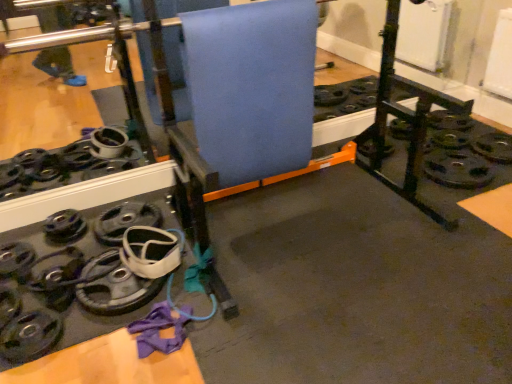
What do you see at coordinates (30, 336) in the screenshot? The image size is (512, 384). I see `black rubber weight at lower left` at bounding box center [30, 336].

I want to click on black rubber weight at lower left, so click(30, 336).

The width and height of the screenshot is (512, 384). Find the location of `blue fabric yoga mat at center`. blue fabric yoga mat at center is located at coordinates (252, 86).

What do you see at coordinates (252, 86) in the screenshot?
I see `blue fabric yoga mat at center` at bounding box center [252, 86].

What are the coordinates of `black rubber weight at lower left` in the screenshot? It's located at (30, 336).

Does blue fabric yoga mat at center appear on the right side of black rubber weight at lower left?

Indeed, blue fabric yoga mat at center is positioned on the right side of black rubber weight at lower left.

Is blue fabric yoga mat at center closer to the viewer compared to black rubber weight at lower left?

No, the depth of blue fabric yoga mat at center is greater than that of black rubber weight at lower left.

Is point (185, 63) in front of point (46, 346)?

No, it is not.

From the image's perspective, which is below, blue fabric yoga mat at center or black rubber weight at lower left?

black rubber weight at lower left.

From a real-world perspective, which is physically below, blue fabric yoga mat at center or black rubber weight at lower left?

black rubber weight at lower left.

Looking at their sizes, would you say blue fabric yoga mat at center is wider or thinner than black rubber weight at lower left?

blue fabric yoga mat at center is thinner than black rubber weight at lower left.

Between blue fabric yoga mat at center and black rubber weight at lower left, which one has more height?

blue fabric yoga mat at center is taller.

Based on their sizes in the image, would you say blue fabric yoga mat at center is bigger or smaller than black rubber weight at lower left?

blue fabric yoga mat at center is bigger than black rubber weight at lower left.

Which is correct: blue fabric yoga mat at center is inside black rubber weight at lower left, or outside of it?

blue fabric yoga mat at center is located beyond the bounds of black rubber weight at lower left.

Is blue fabric yoga mat at center far away from black rubber weight at lower left?

Yes, blue fabric yoga mat at center and black rubber weight at lower left are located far from each other.

Could you tell me if blue fabric yoga mat at center is turned towards black rubber weight at lower left?

No, blue fabric yoga mat at center is not turned towards black rubber weight at lower left.

How different are the orientations of blue fabric yoga mat at center and black rubber weight at lower left in degrees?

There is a 0.000378-degree angle between the facing directions of blue fabric yoga mat at center and black rubber weight at lower left.

You are a GUI agent. You are given a task and a screenshot of the screen. Output one action in this format:
    pyautogui.click(x=<x>, y=<y>)
    Task: Click on the yoga mat located on the right of black rubber weight at lower left
    
    Given the screenshot: What is the action you would take?
    pyautogui.click(x=252, y=86)

In the scene shown: Is black rubber weight at lower left at the left side of blue fabric yoga mat at center?

Yes.

Considering the relative positions of black rubber weight at lower left and blue fabric yoga mat at center in the image provided, is black rubber weight at lower left behind blue fabric yoga mat at center?

No, black rubber weight at lower left is closer to the viewer.

Is point (55, 317) closer to camera compared to point (301, 103)?

Yes.

From the image's perspective, who appears lower, black rubber weight at lower left or blue fabric yoga mat at center?

From the image's view, black rubber weight at lower left is below.

In the scene shown: From a real-world perspective, is black rubber weight at lower left below blue fabric yoga mat at center?

Yes.

Considering the sizes of objects black rubber weight at lower left and blue fabric yoga mat at center in the image provided, who is thinner, black rubber weight at lower left or blue fabric yoga mat at center?

Thinner between the two is blue fabric yoga mat at center.

Is black rubber weight at lower left taller than blue fabric yoga mat at center?

Incorrect, the height of black rubber weight at lower left is not larger of that of blue fabric yoga mat at center.

Considering the sizes of objects black rubber weight at lower left and blue fabric yoga mat at center in the image provided, who is bigger, black rubber weight at lower left or blue fabric yoga mat at center?

Bigger between the two is blue fabric yoga mat at center.

Is black rubber weight at lower left surrounding blue fabric yoga mat at center?

Actually, blue fabric yoga mat at center is outside black rubber weight at lower left.

Would you say black rubber weight at lower left is a long distance from blue fabric yoga mat at center?

Indeed, black rubber weight at lower left is not near blue fabric yoga mat at center.

Is black rubber weight at lower left facing away from blue fabric yoga mat at center?

No, black rubber weight at lower left's orientation is not away from blue fabric yoga mat at center.

Can you tell me how much black rubber weight at lower left and blue fabric yoga mat at center differ in facing direction?

The angle between the facing direction of black rubber weight at lower left and the facing direction of blue fabric yoga mat at center is 0.000378 degrees.

How far apart are black rubber weight at lower left and blue fabric yoga mat at center?

black rubber weight at lower left is 1.20 meters from blue fabric yoga mat at center.

This screenshot has width=512, height=384. I want to click on yoga mat behind the black rubber weight at lower left, so click(x=252, y=86).

Image resolution: width=512 pixels, height=384 pixels. In order to click on yoga mat above the black rubber weight at lower left (from a real-world perspective) in this screenshot , I will do `click(252, 86)`.

I want to click on yoga mat behind the black rubber weight at lower left, so click(x=252, y=86).